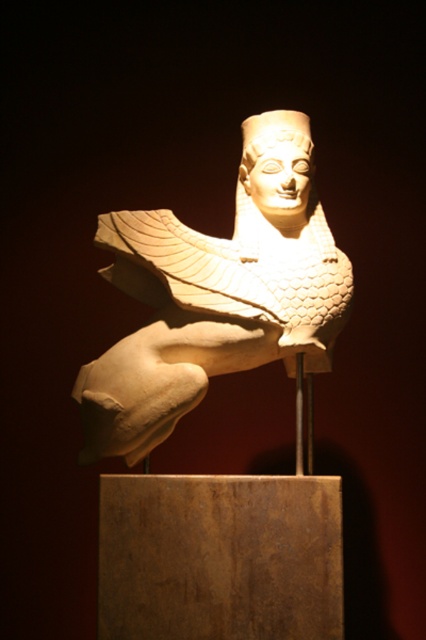
You are an art curator examining the classical sculpture. You notice two white elements at the center of the sculpture. Which one is bigger between the white stone bird at center and the white glossy head at center?

The white stone bird at center is larger than the white glossy head at center.

You are an art student standing 1.5 meters away from a white stone bird at center. Can you reach out and touch it without moving your feet?

The white stone bird at center is 2.00 meters away from the viewer, so you are currently 1.5 meters away. Since you can extend your arm about 0.7 meters, the total distance you can reach is 1.5 meters plus 0.7 meters equals 2.2 meters. Since 2.2 meters is greater than 2.00 meters, you can reach it without moving your feet.